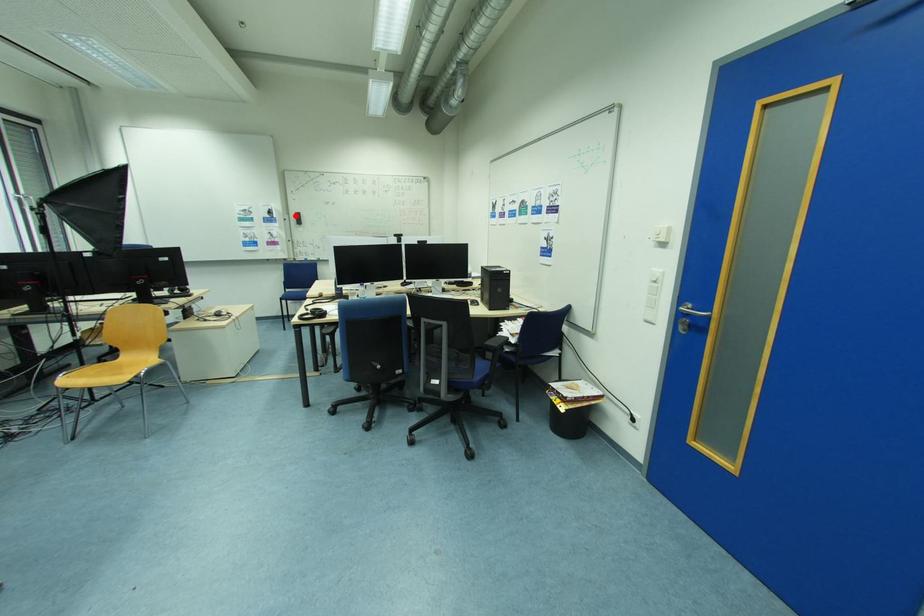
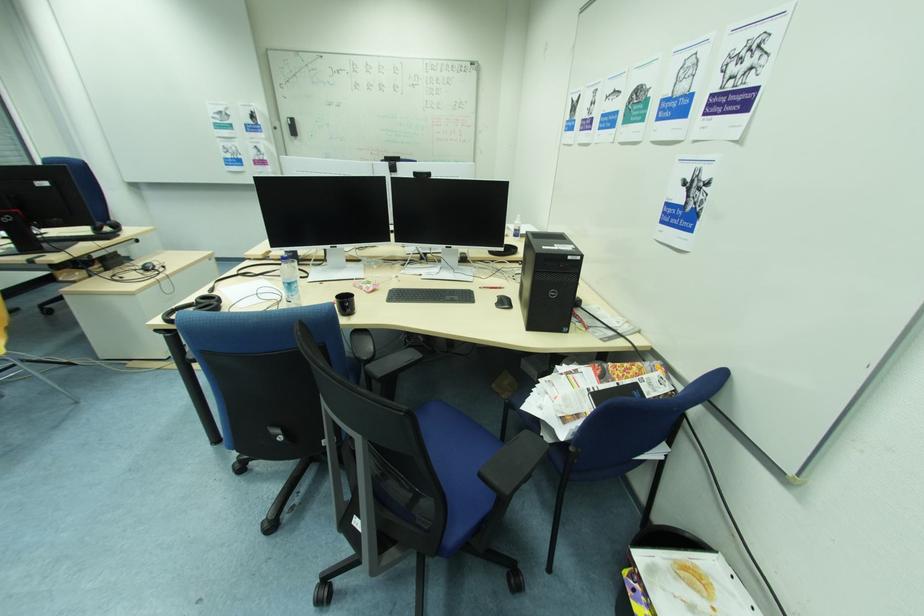
In the second image, find the point that corresponds to the highlighted location in the first image.

(286, 122)